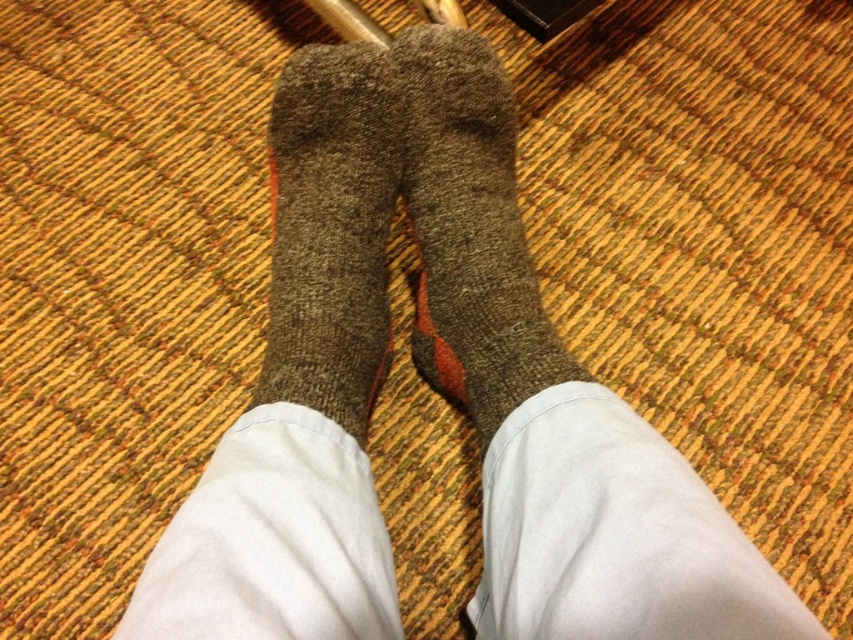
Question: Which object appears closest to the camera in this image?

Choices:
 (A) brown woolen sock at center
 (B) gray woolen sock at center

Answer: (A)

Question: Which of the following is the farthest from the observer?

Choices:
 (A) (519, 294)
 (B) (321, 298)

Answer: (A)

Question: Can you confirm if gray woolen sock at center is positioned to the left of brown woolen sock at center?

Choices:
 (A) yes
 (B) no

Answer: (B)

Question: Which point is farther to the camera?

Choices:
 (A) gray woolen sock at center
 (B) brown woolen sock at center

Answer: (A)

Question: Is gray woolen sock at center smaller than brown woolen sock at center?

Choices:
 (A) yes
 (B) no

Answer: (B)

Question: Does gray woolen sock at center lie behind brown woolen sock at center?

Choices:
 (A) no
 (B) yes

Answer: (B)